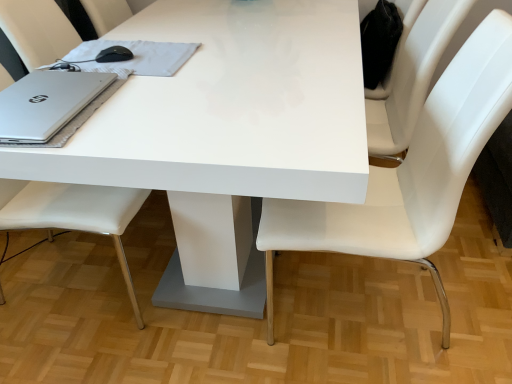
Question: Visually, is satin silver notebook at upper left positioned to the left or to the right of white leather chair at left, which ranks as the second chair in right-to-left order?

Choices:
 (A) left
 (B) right

Answer: (B)

Question: Looking at their shapes, would you say satin silver notebook at upper left is wider or thinner than white leather chair at left, which appears as the first chair when viewed from the left?

Choices:
 (A) wide
 (B) thin

Answer: (B)

Question: Which object is the closest to the silver metallic laptop at left?

Choices:
 (A) satin silver notebook at upper left
 (B) white leather chair at left, which appears as the first chair when viewed from the left
 (C) white leather chair at center, positioned as the first chair in right-to-left order
 (D) white glossy table at center

Answer: (A)

Question: Which object is the farthest from the white leather chair at left, which ranks as the second chair in right-to-left order?

Choices:
 (A) satin silver notebook at upper left
 (B) white glossy table at center
 (C) silver metallic laptop at left
 (D) white leather chair at center, which is the second chair in left-to-right order

Answer: (D)